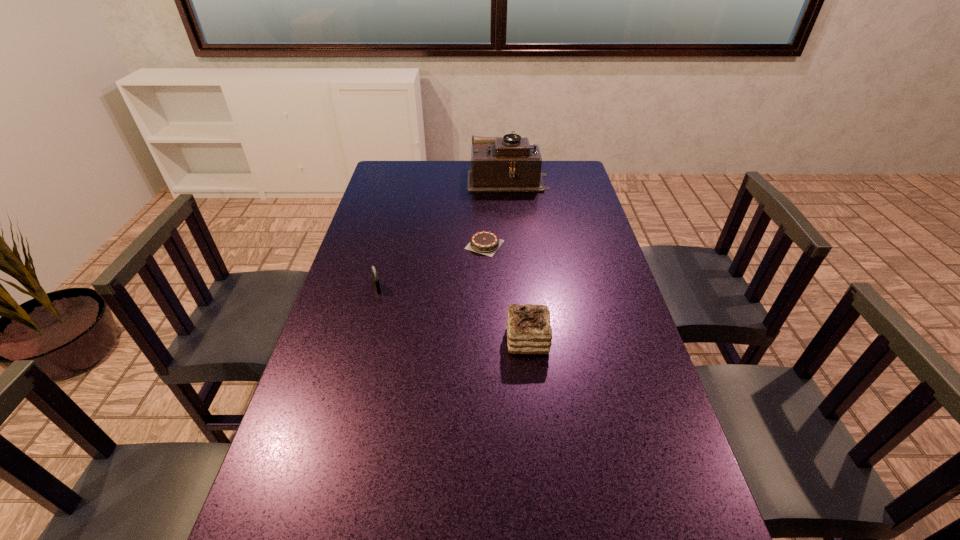
Where is `phonograph_record`? The height and width of the screenshot is (540, 960). phonograph_record is located at coordinates (498, 164).

Locate an element on the screen. the tallest object is located at coordinates (498, 164).

The width and height of the screenshot is (960, 540). Find the location of `the nearer chocolate cake`. the nearer chocolate cake is located at coordinates (529, 331).

Identify the location of the nearest object. Image resolution: width=960 pixels, height=540 pixels. (529, 331).

I want to click on padlock, so click(375, 278).

Where is `the third tallest object`? Image resolution: width=960 pixels, height=540 pixels. the third tallest object is located at coordinates (375, 278).

This screenshot has width=960, height=540. What are the coordinates of `the third nearest object` in the screenshot? It's located at (483, 242).

Locate an element on the screen. the shortest object is located at coordinates (483, 242).

In order to click on free point located on the horn of the phonograph_record in this screenshot , I will do `click(424, 178)`.

The image size is (960, 540). I want to click on free space located 0.160m on the horn of the phonograph_record, so click(x=429, y=178).